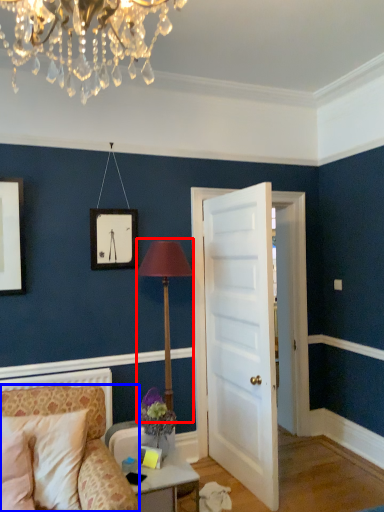
Question: Which object appears closest to the camera in this image, table lamp (highlighted by a red box) or chair (highlighted by a blue box)?

Choices:
 (A) table lamp
 (B) chair

Answer: (B)